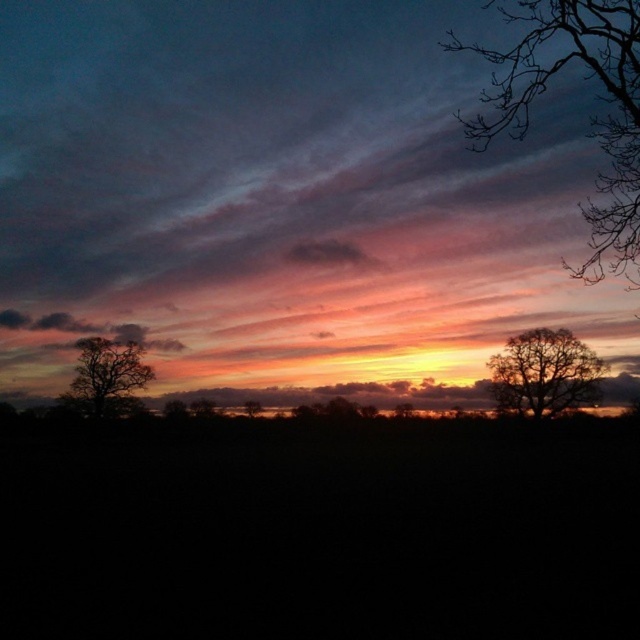
Looking at this image, you are an astronomer observing the sunset scene. You notice a point labeled as point (88, 328). What object is located at that coordinate?

The point (88, 328) indicates a dark gray cloud at left.

You are an astronomer trying to position a telescope to capture the sunset. The telescope has a fixed mount at point A. The coordinates of point A are given as a reference. Where should you aim the telescope to avoid the bare branches at upper right?

The bare branches at upper right is located at point (592, 118), so you should aim the telescope away from that coordinate to avoid obstruction.

You are standing at a point in the sunset scene and want to know how far you are from the point marked as point (100, 333). Can you determine the distance?

The distance between you and point (100, 333) is 331.77 feet.